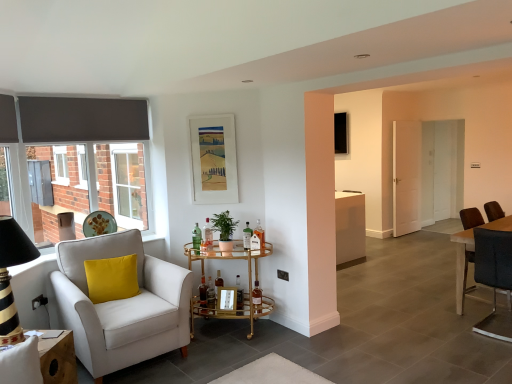
Image resolution: width=512 pixels, height=384 pixels. I want to click on vacant position to the left of white wooden table at right, so click(x=439, y=294).